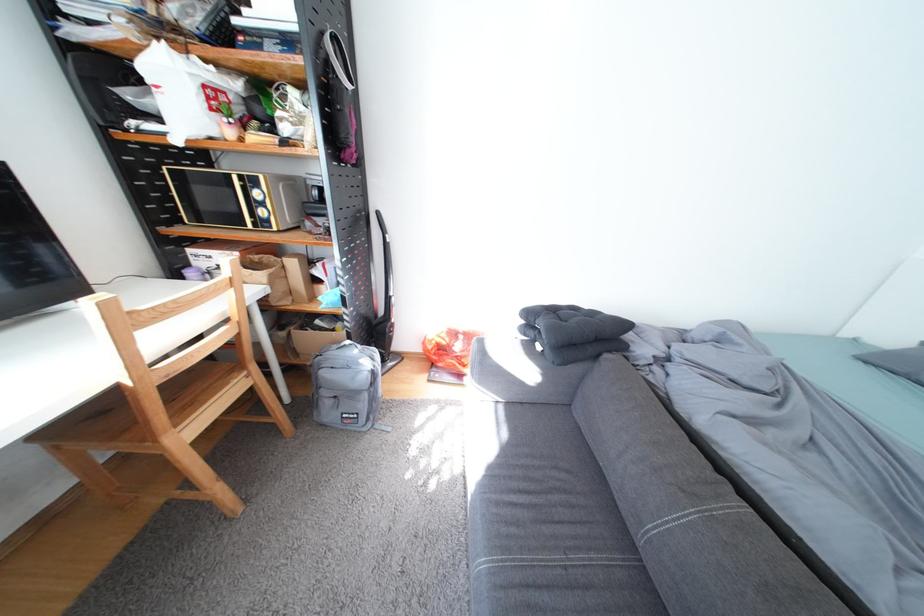
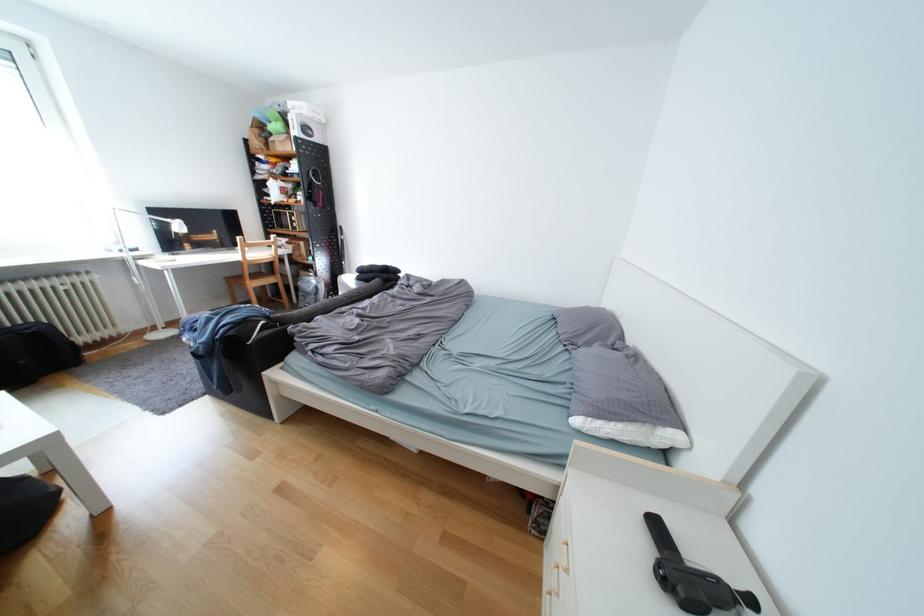
The point at (336, 392) is marked in the first image. Where is the corresponding point in the second image?

(313, 294)